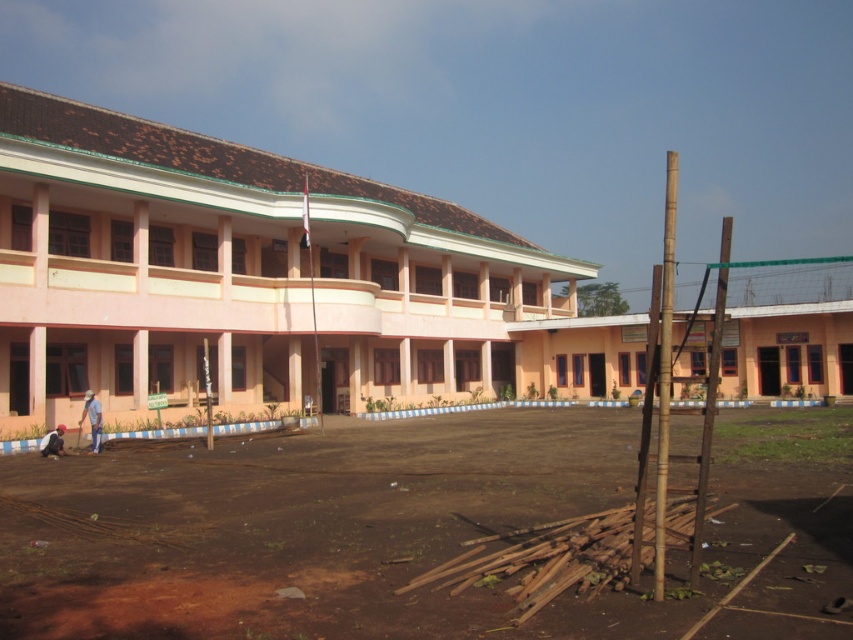
Question: Estimate the real-world distances between objects in this image. Which object is closer to the brown dirt field at center?

Choices:
 (A) dark blue jeans at lower left
 (B) light brown straw hat at lower left

Answer: (A)

Question: Considering the real-world distances, which object is closest to the light brown straw hat at lower left?

Choices:
 (A) dark blue jeans at lower left
 (B) brown dirt field at center

Answer: (A)

Question: Does brown dirt field at center have a lesser width compared to dark blue jeans at lower left?

Choices:
 (A) no
 (B) yes

Answer: (A)

Question: Which point is farther from the camera taking this photo?

Choices:
 (A) (x=61, y=448)
 (B) (x=94, y=416)

Answer: (B)

Question: Does brown dirt field at center appear under light brown straw hat at lower left?

Choices:
 (A) no
 (B) yes

Answer: (B)

Question: Does light brown straw hat at lower left come in front of dark blue jeans at lower left?

Choices:
 (A) yes
 (B) no

Answer: (B)